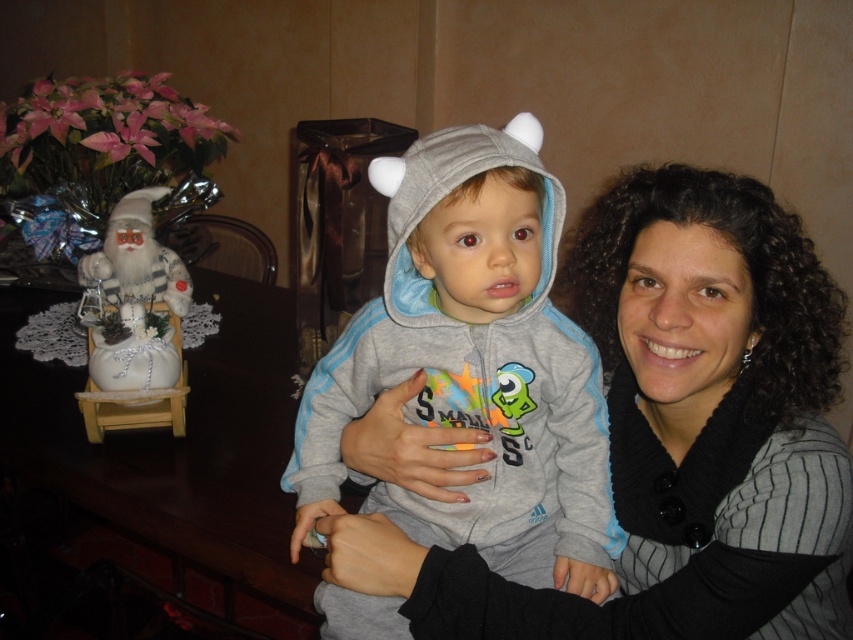
Question: Can you confirm if gray fleece hoodie at center is positioned below white fabric santa at left?

Choices:
 (A) yes
 (B) no

Answer: (A)

Question: Does gray fleece hoodie at center have a lesser width compared to white fabric santa at left?

Choices:
 (A) yes
 (B) no

Answer: (B)

Question: Does gray fleece hoodie at center come in front of white fabric santa at left?

Choices:
 (A) yes
 (B) no

Answer: (A)

Question: Which object appears closest to the camera in this image?

Choices:
 (A) white fabric santa at left
 (B) gray fleece hoodie at center

Answer: (B)